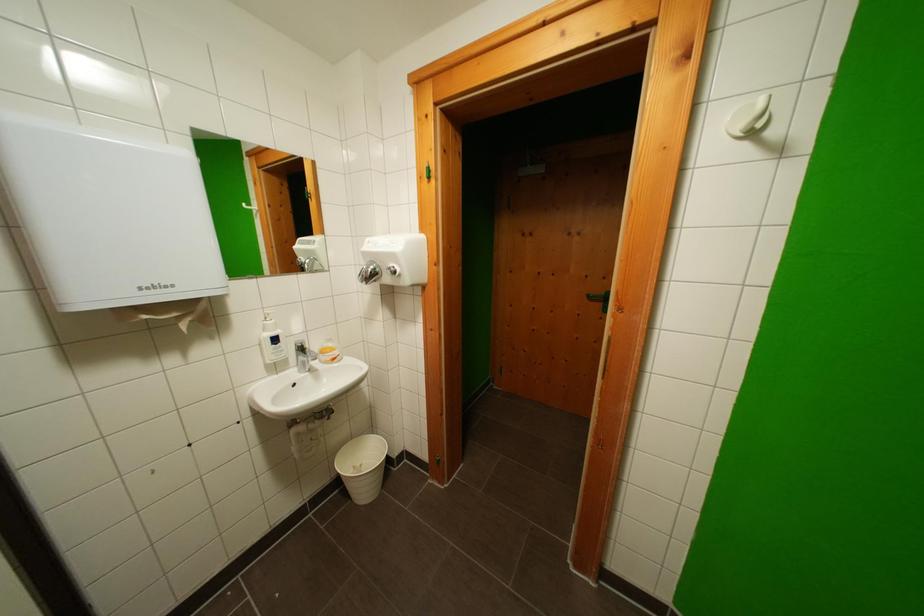
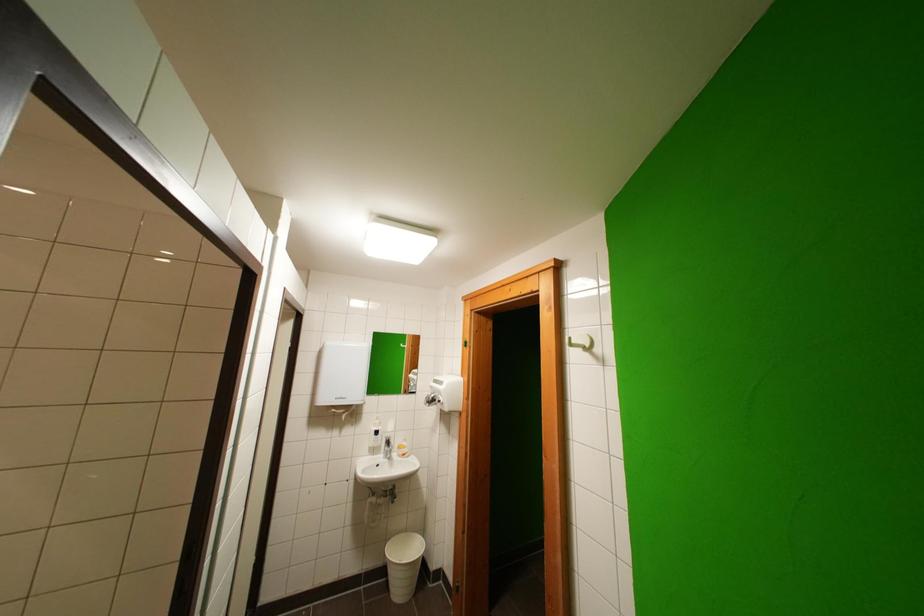
Find the pixel in the second image that matches [282,342] in the first image.

(383, 436)